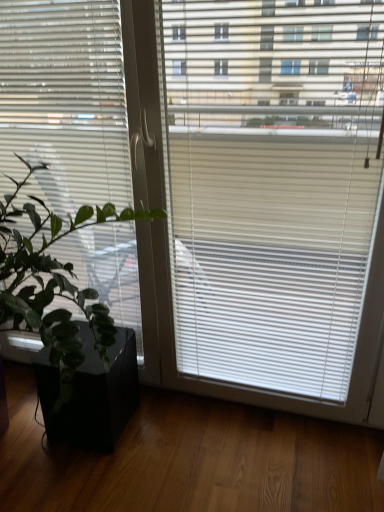
Question: Does white matte window blind at left have a larger size compared to black matte flowerpot at lower left?

Choices:
 (A) yes
 (B) no

Answer: (A)

Question: Does white matte window blind at left have a greater width compared to black matte flowerpot at lower left?

Choices:
 (A) yes
 (B) no

Answer: (B)

Question: Is white matte window blind at left to the left of black matte flowerpot at lower left from the viewer's perspective?

Choices:
 (A) yes
 (B) no

Answer: (A)

Question: From the image's perspective, is white matte window blind at left above black matte flowerpot at lower left?

Choices:
 (A) yes
 (B) no

Answer: (A)

Question: From a real-world perspective, does white matte window blind at left sit lower than black matte flowerpot at lower left?

Choices:
 (A) no
 (B) yes

Answer: (A)

Question: Is green matte plant at left in front of or behind black matte flowerpot at lower left in the image?

Choices:
 (A) behind
 (B) front

Answer: (B)

Question: From the image's perspective, is green matte plant at left located above or below black matte flowerpot at lower left?

Choices:
 (A) above
 (B) below

Answer: (A)

Question: In terms of width, does green matte plant at left look wider or thinner when compared to black matte flowerpot at lower left?

Choices:
 (A) wide
 (B) thin

Answer: (A)

Question: Looking at the image, does green matte plant at left seem bigger or smaller compared to black matte flowerpot at lower left?

Choices:
 (A) big
 (B) small

Answer: (A)

Question: Is white matte window blind at left inside or outside of green matte plant at left?

Choices:
 (A) inside
 (B) outside

Answer: (A)

Question: Is white matte window blind at left taller or shorter than green matte plant at left?

Choices:
 (A) tall
 (B) short

Answer: (A)

Question: Considering the positions of point (77, 47) and point (51, 351), is point (77, 47) closer or farther from the camera than point (51, 351)?

Choices:
 (A) closer
 (B) farther

Answer: (B)

Question: Is white matte window blind at left bigger or smaller than green matte plant at left?

Choices:
 (A) small
 (B) big

Answer: (A)

Question: From a real-world perspective, is green matte plant at left above or below white matte window blind at left?

Choices:
 (A) above
 (B) below

Answer: (B)

Question: Considering the positions of green matte plant at left and white matte window blind at left in the image, is green matte plant at left taller or shorter than white matte window blind at left?

Choices:
 (A) short
 (B) tall

Answer: (A)